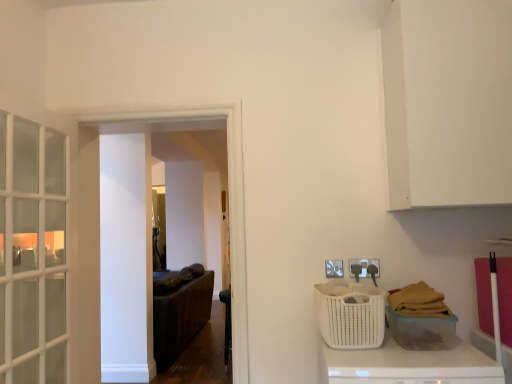
Question: Are white matte counter top at lower right and white woven basket at lower right, which is the first basket in left-to-right order, far apart?

Choices:
 (A) no
 (B) yes

Answer: (A)

Question: Does white matte counter top at lower right turn towards white woven basket at lower right, the 2th basket viewed from the right?

Choices:
 (A) yes
 (B) no

Answer: (B)

Question: Is white matte counter top at lower right to the right of white woven basket at lower right, which is the first basket in left-to-right order, from the viewer's perspective?

Choices:
 (A) no
 (B) yes

Answer: (B)

Question: From the image's perspective, is white matte counter top at lower right under white woven basket at lower right, which is the first basket in left-to-right order?

Choices:
 (A) yes
 (B) no

Answer: (A)

Question: Can you confirm if white matte counter top at lower right is shorter than white woven basket at lower right, which is the first basket in left-to-right order?

Choices:
 (A) no
 (B) yes

Answer: (A)

Question: From a real-world perspective, is white matte counter top at lower right physically above white woven basket at lower right, which is the first basket in left-to-right order?

Choices:
 (A) yes
 (B) no

Answer: (B)

Question: Does black leather chair at center come behind white matte counter top at lower right?

Choices:
 (A) no
 (B) yes

Answer: (B)

Question: Is black leather chair at center facing away from white matte counter top at lower right?

Choices:
 (A) yes
 (B) no

Answer: (B)

Question: Is black leather chair at center not within white matte counter top at lower right?

Choices:
 (A) yes
 (B) no

Answer: (A)

Question: Does black leather chair at center contain white matte counter top at lower right?

Choices:
 (A) yes
 (B) no

Answer: (B)

Question: Would you say black leather chair at center is a long distance from white matte counter top at lower right?

Choices:
 (A) yes
 (B) no

Answer: (A)

Question: Considering the relative sizes of black leather chair at center and white matte counter top at lower right in the image provided, is black leather chair at center bigger than white matte counter top at lower right?

Choices:
 (A) yes
 (B) no

Answer: (B)

Question: Is white matte counter top at lower right not near white wicker basket at lower right, which is the first basket in right-to-left order?

Choices:
 (A) yes
 (B) no

Answer: (B)